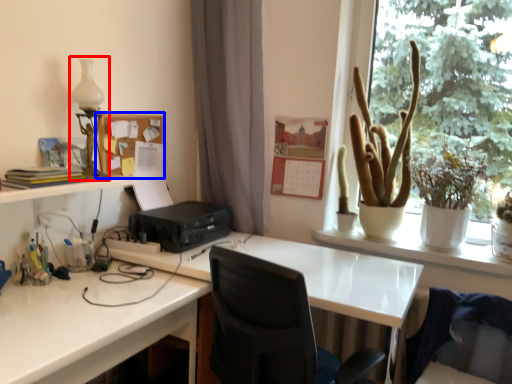
Question: Which point is closer to the camera, table lamp (highlighted by a red box) or bulletin board (highlighted by a blue box)?

Choices:
 (A) table lamp
 (B) bulletin board

Answer: (A)